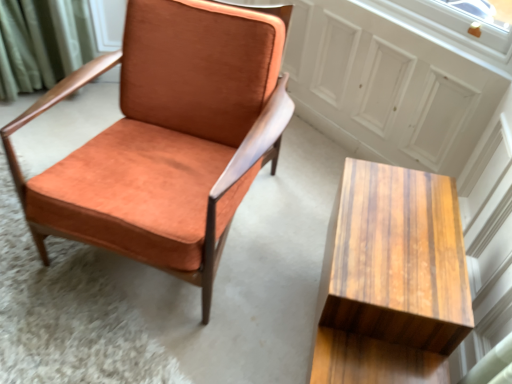
What do you see at coordinates (168, 138) in the screenshot?
I see `orange suede chair at center` at bounding box center [168, 138].

You are a GUI agent. You are given a task and a screenshot of the screen. Output one action in this format:
    pyautogui.click(x=<x>, y=<y>)
    Task: Click on the orange suede chair at center
    
    Given the screenshot: What is the action you would take?
    pyautogui.click(x=168, y=138)

From the picture: In order to face orange suede chair at center, should I rotate leftwards or rightwards?

Turn left approximately 10.399 degrees to face it.

What is the approximate height of wooden table at lower right?

17.92 inches.

What do you see at coordinates (391, 279) in the screenshot? I see `wooden table at lower right` at bounding box center [391, 279].

Consider the image. What is the approximate width of wooden table at lower right?

It is 36.91 centimeters.

At what (x,y) coordinates should I click in order to perform the action: click on wooden table at lower right. Please return your answer as a coordinate pair (x, y). Looking at the image, I should click on (391, 279).

The image size is (512, 384). I want to click on orange suede chair at center, so click(x=168, y=138).

Is orange suede chair at center at the right side of wooden table at lower right?

No, orange suede chair at center is not to the right of wooden table at lower right.

Between orange suede chair at center and wooden table at lower right, which one is positioned in front?

wooden table at lower right is in front.

Which is in front, point (288, 113) or point (355, 303)?

The point (355, 303) is closer to the camera.

From the image's perspective, which object appears higher, orange suede chair at center or wooden table at lower right?

orange suede chair at center.

From a real-world perspective, is orange suede chair at center located beneath wooden table at lower right?

No, from a real-world perspective, orange suede chair at center is not beneath wooden table at lower right.

Does orange suede chair at center have a lesser width compared to wooden table at lower right?

Incorrect, the width of orange suede chair at center is not less than that of wooden table at lower right.

Between orange suede chair at center and wooden table at lower right, which one has less height?

Standing shorter between the two is wooden table at lower right.

Who is smaller, orange suede chair at center or wooden table at lower right?

wooden table at lower right is smaller.

Is orange suede chair at center not within wooden table at lower right?

That's correct, orange suede chair at center is outside of wooden table at lower right.

Are orange suede chair at center and wooden table at lower right making contact?

orange suede chair at center is not next to wooden table at lower right, and they're not touching.

Is orange suede chair at center oriented away from wooden table at lower right?

No.

How many degrees apart are the facing directions of orange suede chair at center and wooden table at lower right?

84.6 degrees separate the facing orientations of orange suede chair at center and wooden table at lower right.

Locate an element on the screen. table in front of the orange suede chair at center is located at coordinates (391, 279).

Considering the positions of objects wooden table at lower right and orange suede chair at center in the image provided, who is more to the left, wooden table at lower right or orange suede chair at center?

From the viewer's perspective, orange suede chair at center appears more on the left side.

Between wooden table at lower right and orange suede chair at center, which one is positioned in front?

wooden table at lower right is more forward.

Between point (362, 230) and point (177, 24), which one is positioned in front?

The point (362, 230) is closer.

From the image's perspective, would you say wooden table at lower right is positioned over orange suede chair at center?

No, from the image's perspective, wooden table at lower right is not above orange suede chair at center.

From a real-world perspective, which is physically above, wooden table at lower right or orange suede chair at center?

orange suede chair at center.

Considering the sizes of objects wooden table at lower right and orange suede chair at center in the image provided, who is thinner, wooden table at lower right or orange suede chair at center?

With smaller width is wooden table at lower right.

Is wooden table at lower right shorter than orange suede chair at center?

Yes, wooden table at lower right is shorter than orange suede chair at center.

Between wooden table at lower right and orange suede chair at center, which one has smaller size?

wooden table at lower right.

Is orange suede chair at center a part of wooden table at lower right?

No, orange suede chair at center is located outside of wooden table at lower right.

Is wooden table at lower right directly adjacent to orange suede chair at center?

Result: No.

Is wooden table at lower right oriented away from orange suede chair at center?

No, wooden table at lower right's orientation is not away from orange suede chair at center.

How different are the orientations of wooden table at lower right and orange suede chair at center in degrees?

The facing directions of wooden table at lower right and orange suede chair at center are 84.6 degrees apart.

Locate an element on the screen. Image resolution: width=512 pixels, height=384 pixels. chair that is behind the wooden table at lower right is located at coordinates (168, 138).

Identify the location of chair that is above the wooden table at lower right (from a real-world perspective). (168, 138).

The image size is (512, 384). In order to click on table in front of the orange suede chair at center in this screenshot , I will do `click(391, 279)`.